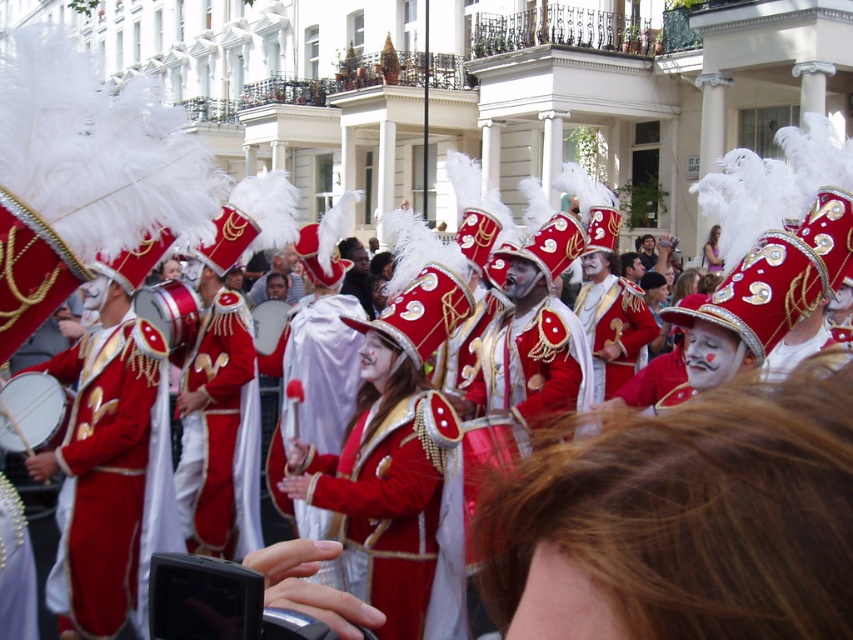
Question: Which object is positioned farthest from the shiny red fabric at center?

Choices:
 (A) smooth brown hair at center
 (B) shiny red fabric drum at left

Answer: (A)

Question: Considering the real-world distances, which object is closest to the light brown fabric dress at center?

Choices:
 (A) shiny red fabric at center
 (B) smooth brown hair at center

Answer: (A)

Question: From the image, what is the correct spatial relationship of smooth brown hair at center in relation to shiny red fabric at center?

Choices:
 (A) right
 (B) left

Answer: (A)

Question: Which point is closer to the camera taking this photo?

Choices:
 (A) (107, 561)
 (B) (444, 304)

Answer: (A)

Question: Does smooth brown hair at center have a greater width compared to shiny red coat at center?

Choices:
 (A) yes
 (B) no

Answer: (B)

Question: Is smooth brown hair at center below shiny red coat at center?

Choices:
 (A) no
 (B) yes

Answer: (B)